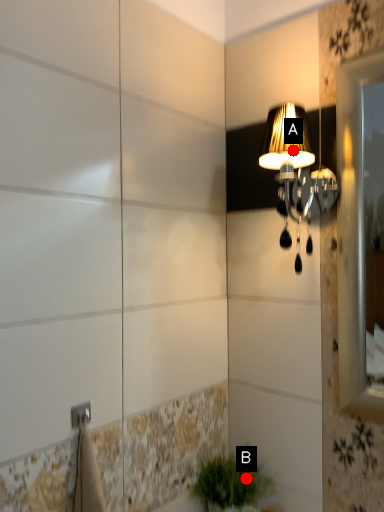
Question: Two points are circled on the image, labeled by A and B beside each circle. Which point is farther to the camera?

Choices:
 (A) A is further
 (B) B is further

Answer: (B)